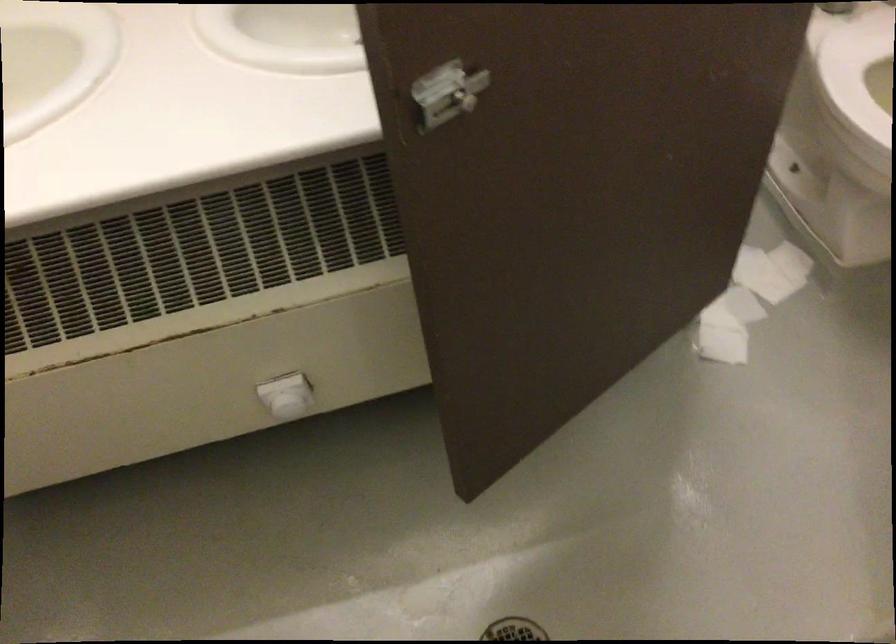
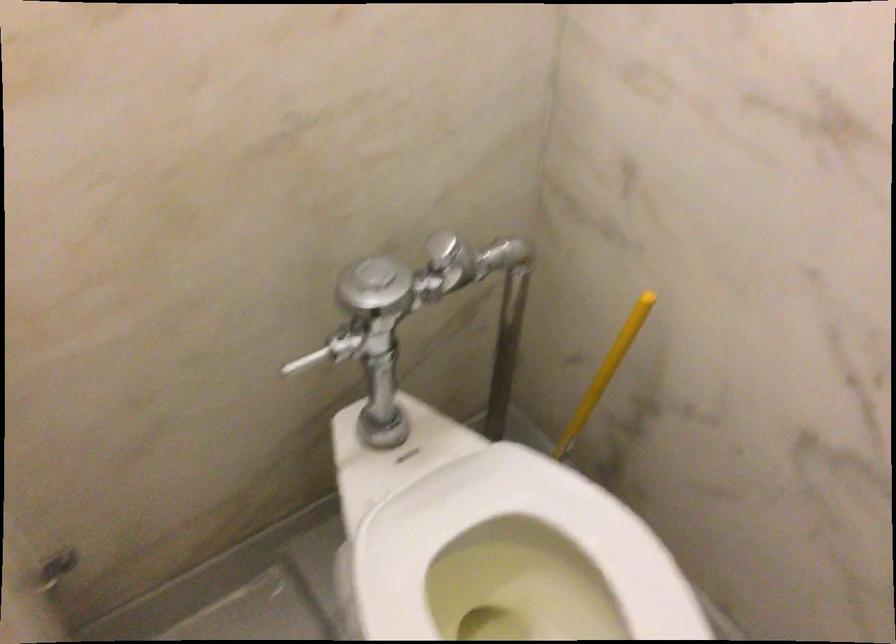
Which direction would the cameraman need to move to produce the second image?

The cameraman moved toward right, forward.